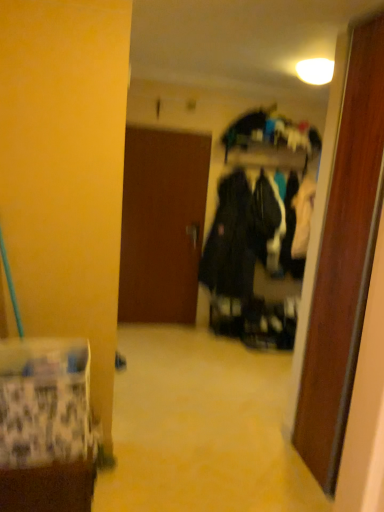
Question: Does patterned fabric bag at lower left come behind brown matte door at center?

Choices:
 (A) yes
 (B) no

Answer: (B)

Question: Considering the relative sizes of patterned fabric bag at lower left and brown matte door at center in the image provided, is patterned fabric bag at lower left smaller than brown matte door at center?

Choices:
 (A) no
 (B) yes

Answer: (B)

Question: Does patterned fabric bag at lower left have a lesser width compared to brown matte door at center?

Choices:
 (A) yes
 (B) no

Answer: (B)

Question: From a real-world perspective, is patterned fabric bag at lower left below brown matte door at center?

Choices:
 (A) yes
 (B) no

Answer: (A)

Question: Can you confirm if patterned fabric bag at lower left is bigger than brown matte door at center?

Choices:
 (A) yes
 (B) no

Answer: (B)

Question: From the image's perspective, is patterned fabric bag at lower left on brown matte door at center?

Choices:
 (A) yes
 (B) no

Answer: (B)

Question: Does brown matte door at center lie behind patterned fabric bag at lower left?

Choices:
 (A) yes
 (B) no

Answer: (A)

Question: Is brown matte door at center bigger than patterned fabric bag at lower left?

Choices:
 (A) yes
 (B) no

Answer: (A)

Question: Is brown matte door at center to the left of patterned fabric bag at lower left from the viewer's perspective?

Choices:
 (A) yes
 (B) no

Answer: (B)

Question: Does brown matte door at center have a lesser height compared to patterned fabric bag at lower left?

Choices:
 (A) yes
 (B) no

Answer: (B)

Question: Is brown matte door at center closer to the viewer compared to patterned fabric bag at lower left?

Choices:
 (A) no
 (B) yes

Answer: (A)

Question: Is brown matte door at center thinner than patterned fabric bag at lower left?

Choices:
 (A) no
 (B) yes

Answer: (B)

Question: Considering the relative positions of brown matte door at center and patterned fabric bag at lower left in the image provided, is brown matte door at center to the left or to the right of patterned fabric bag at lower left?

Choices:
 (A) right
 (B) left

Answer: (A)